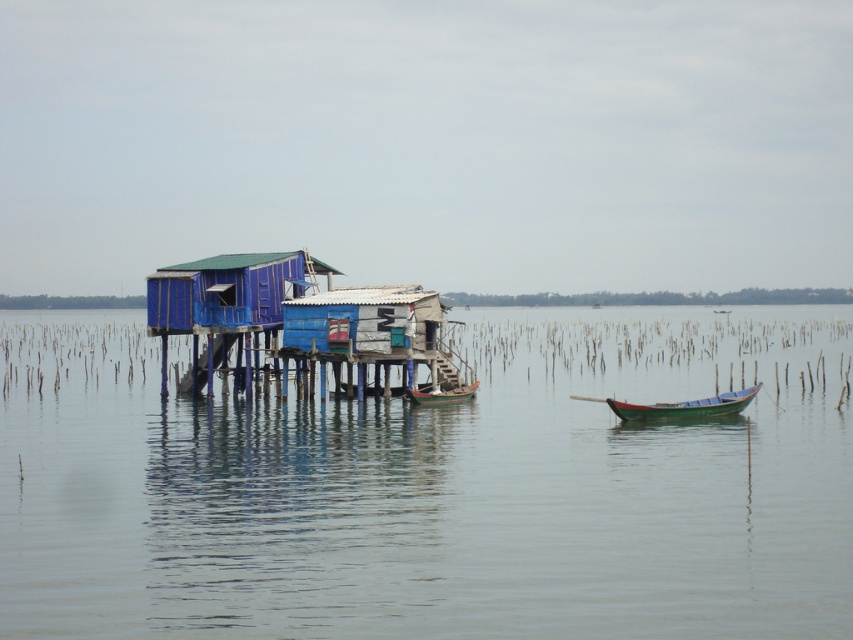
Can you confirm if clear water at house left is taller than blue tarpaulin hut at center?

Correct, clear water at house left is much taller as blue tarpaulin hut at center.

Consider the image. Does clear water at house left have a lesser width compared to blue tarpaulin hut at center?

In fact, clear water at house left might be wider than blue tarpaulin hut at center.

Who is more distant from viewer, [723,346] or [155,330]?

The point [723,346] is behind.

The width and height of the screenshot is (853, 640). I want to click on clear water at house left, so click(431, 488).

Does green wooden boat at right have a smaller size compared to wooden boat at center?

Incorrect, green wooden boat at right is not smaller in size than wooden boat at center.

Which is behind, point (627, 419) or point (434, 404)?

The point (434, 404) is behind.

This screenshot has width=853, height=640. I want to click on green wooden boat at right, so click(x=685, y=406).

Is clear water at house left further to camera compared to green wooden boat at right?

No, it is not.

Does clear water at house left have a larger size compared to green wooden boat at right?

Indeed, clear water at house left has a larger size compared to green wooden boat at right.

Which is in front, point (758, 362) or point (613, 410)?

Positioned in front is point (613, 410).

The image size is (853, 640). I want to click on clear water at house left, so click(x=431, y=488).